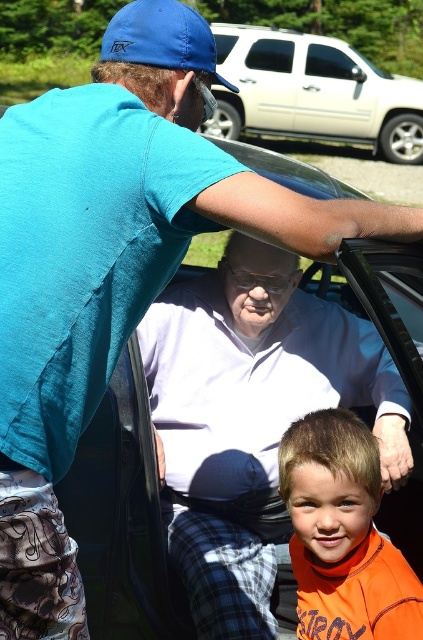
Question: Is matte black car at center to the left of orange fleece at lower right from the viewer's perspective?

Choices:
 (A) yes
 (B) no

Answer: (A)

Question: Based on their relative distances, which object is nearer to the orange fleece at lower right?

Choices:
 (A) white matte suv at upper center
 (B) matte black car at center

Answer: (B)

Question: From the image, what is the correct spatial relationship of white matte car door at upper center in relation to transparent glass window at center?

Choices:
 (A) right
 (B) left

Answer: (A)

Question: Which point is farther to the camera?

Choices:
 (A) (255, 54)
 (B) (345, 76)
 (C) (296, 547)

Answer: (B)

Question: Does matte black car at center appear over white matte car door at upper center?

Choices:
 (A) no
 (B) yes

Answer: (A)

Question: Which of the following is the farthest from the observer?

Choices:
 (A) (102, 580)
 (B) (409, 634)
 (C) (414, 125)

Answer: (C)